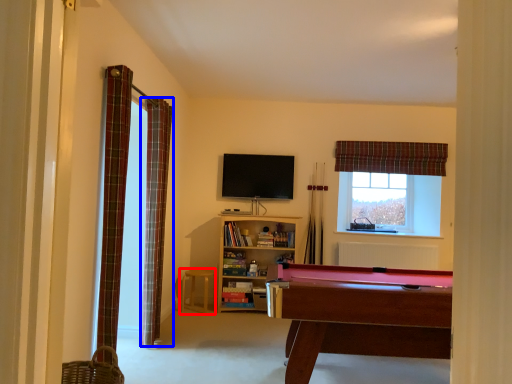
Question: Which point is further to the camera, stool (highlighted by a red box) or curtain (highlighted by a blue box)?

Choices:
 (A) stool
 (B) curtain

Answer: (A)